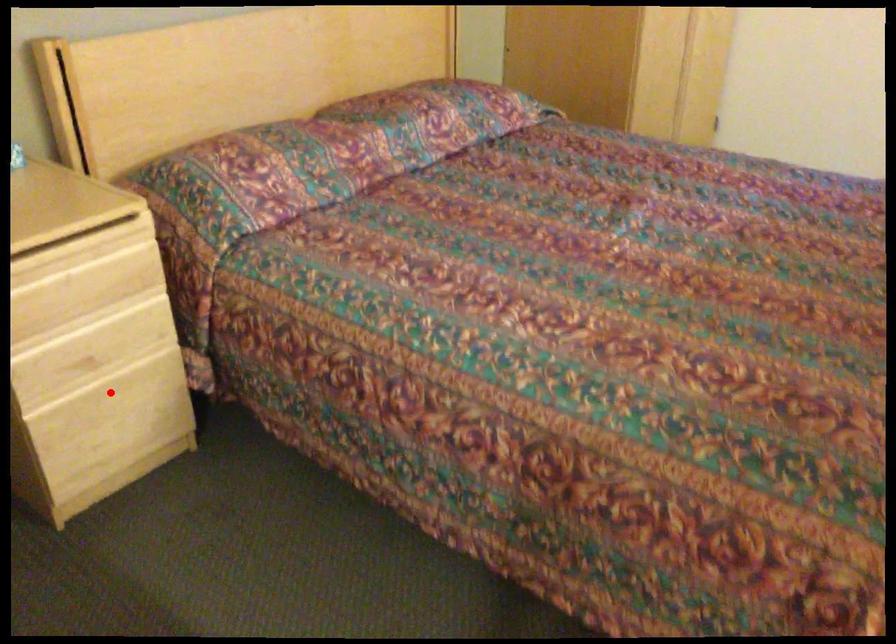
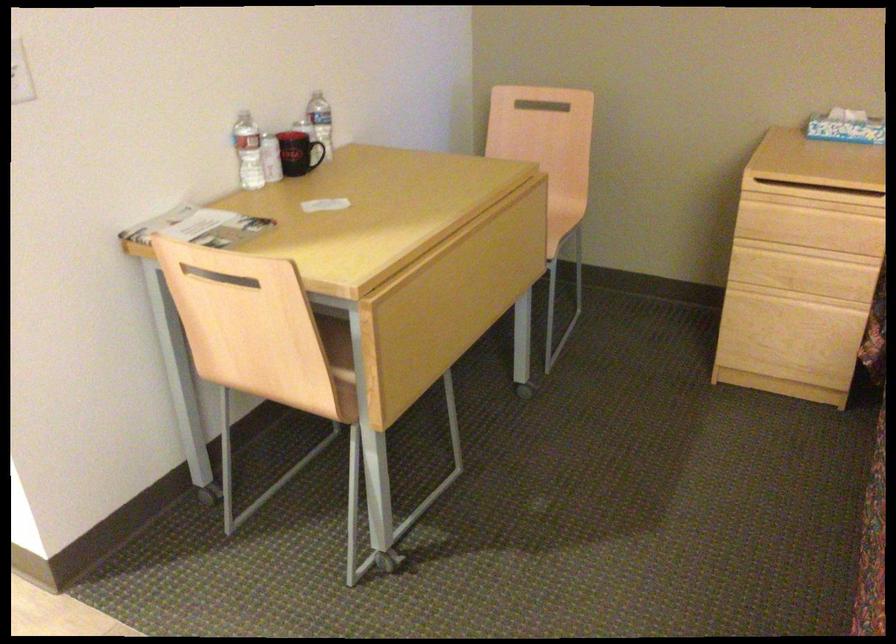
Question: I am providing you with two images of the same scene from different viewpoints. Given a red point in image1, look at the same physical point in image2. Is it:

Choices:
 (A) Closer to the viewpoint
 (B) Farther from the viewpoint

Answer: (B)